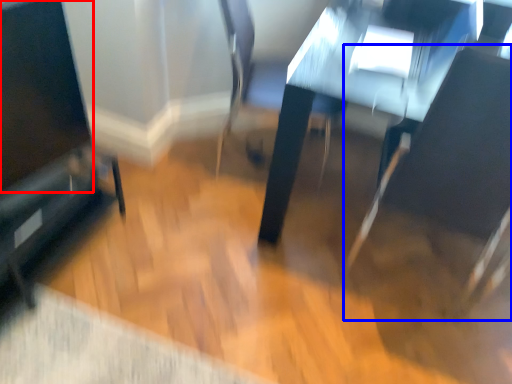
Question: Which object is closer to the camera taking this photo, screen (highlighted by a red box) or swivel chair (highlighted by a blue box)?

Choices:
 (A) screen
 (B) swivel chair

Answer: (B)